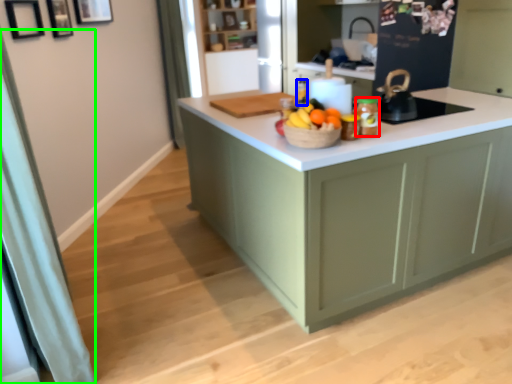
Question: Which object is the closest to the kitchen appliance (highlighted by a red box)? Choose among these: bottle (highlighted by a blue box) or curtain (highlighted by a green box).

Choices:
 (A) bottle
 (B) curtain

Answer: (A)